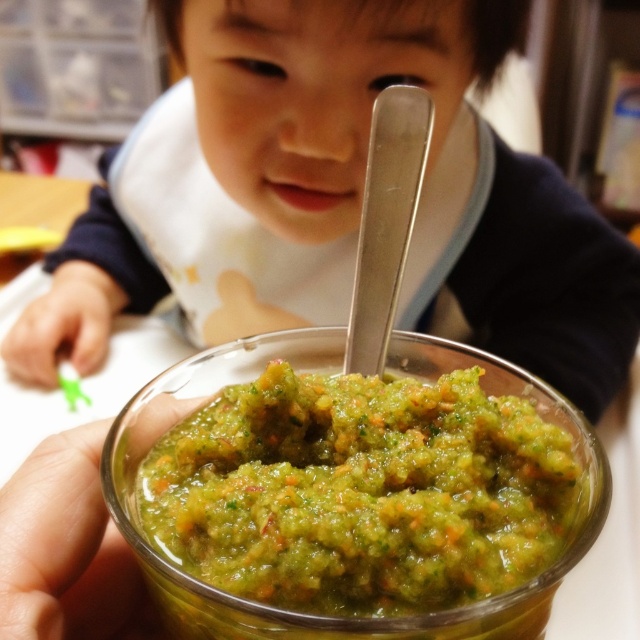
Question: Which object is farther from the camera taking this photo?

Choices:
 (A) matte white bib at upper center
 (B) shiny silver spoon at center
 (C) green paste at center

Answer: (A)

Question: Which of these objects is positioned closest to the shiny silver spoon at center?

Choices:
 (A) matte white bib at upper center
 (B) green paste at center

Answer: (B)

Question: Based on their relative distances, which object is nearer to the matte white bib at upper center?

Choices:
 (A) green paste at center
 (B) shiny silver spoon at center

Answer: (A)

Question: Where is green paste at center located in relation to shiny silver spoon at center in the image?

Choices:
 (A) left
 (B) right

Answer: (A)

Question: Can you confirm if matte white bib at upper center is bigger than shiny silver spoon at center?

Choices:
 (A) yes
 (B) no

Answer: (A)

Question: Is green paste at center to the left of shiny silver spoon at center from the viewer's perspective?

Choices:
 (A) no
 (B) yes

Answer: (B)